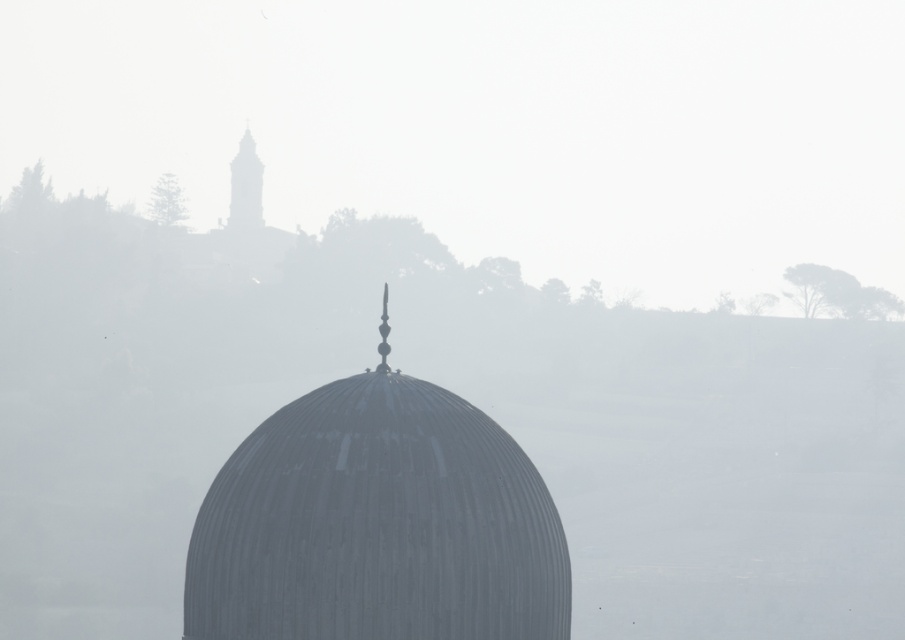
Question: Can you confirm if metallic dome at center is positioned below smooth stone tower at upper left?

Choices:
 (A) yes
 (B) no

Answer: (A)

Question: Can you confirm if metallic dome at center is thinner than smooth stone tower at upper left?

Choices:
 (A) no
 (B) yes

Answer: (A)

Question: Which point appears closest to the camera in this image?

Choices:
 (A) (252, 195)
 (B) (237, 499)

Answer: (B)

Question: Does metallic dome at center appear under smooth stone tower at upper left?

Choices:
 (A) no
 (B) yes

Answer: (B)

Question: Which object appears closest to the camera in this image?

Choices:
 (A) metallic dome at center
 (B) smooth stone tower at upper left

Answer: (A)

Question: Among these objects, which one is farthest from the camera?

Choices:
 (A) metallic dome at center
 (B) smooth stone tower at upper left

Answer: (B)